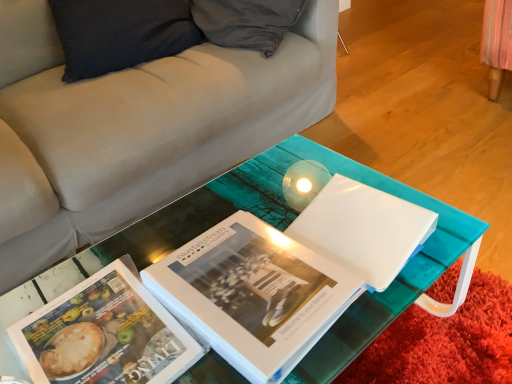
Locate an element on the screen. Image resolution: width=512 pixels, height=384 pixels. vacant space situated above matte paper book at center, which is counted as the 2th book, starting from the right (from a real-world perspective) is located at coordinates (96, 324).